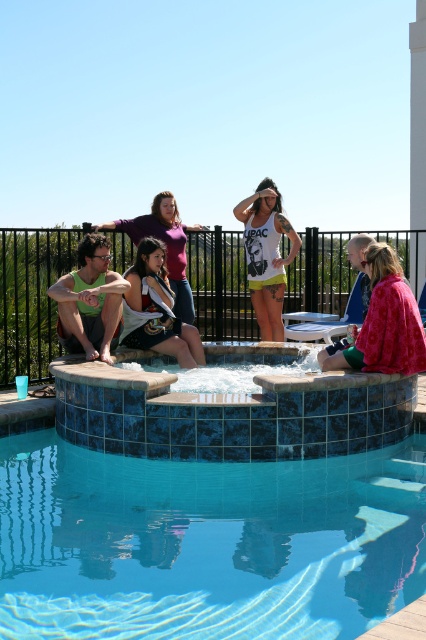
Question: Considering the relative positions of green matte tank top at left and denim skirt at center in the image provided, where is green matte tank top at left located with respect to denim skirt at center?

Choices:
 (A) below
 (B) above

Answer: (B)

Question: Based on their relative distances, which object is nearer to the white matte tank top at center?

Choices:
 (A) matte purple tank top at center
 (B) floral fabric jacket at lower right

Answer: (A)

Question: Does green matte tank top at left have a greater width compared to white matte tank top at center?

Choices:
 (A) yes
 (B) no

Answer: (B)

Question: Which point is farther to the camera?

Choices:
 (A) click(x=175, y=227)
 (B) click(x=141, y=337)
 (C) click(x=253, y=292)

Answer: (C)

Question: Can you confirm if blue tile swimming pool at lower center is thinner than floral fabric jacket at lower right?

Choices:
 (A) no
 (B) yes

Answer: (A)

Question: Which of the following is the closest to the observer?

Choices:
 (A) blue tile swimming pool at lower center
 (B) white matte tank top at center
 (C) green matte tank top at left
 (D) denim skirt at center

Answer: (A)